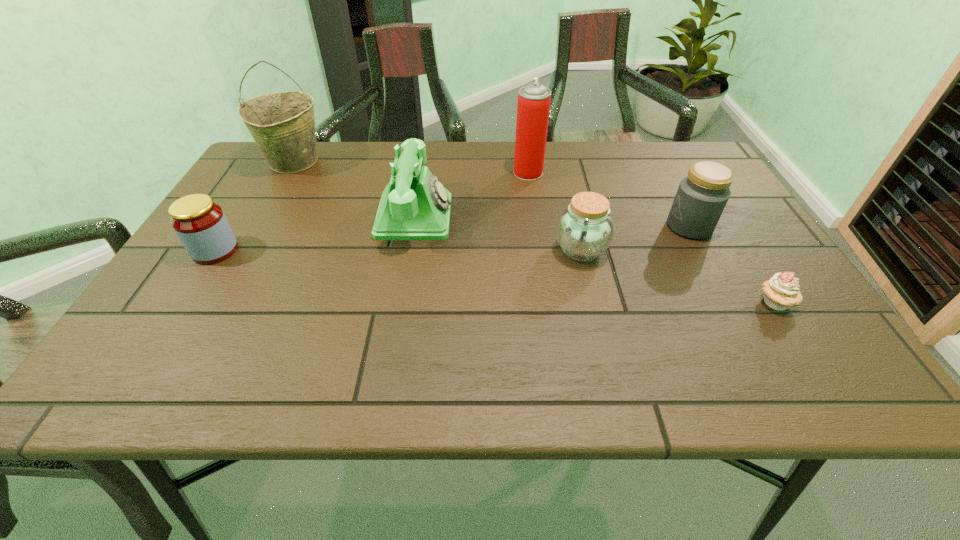
This screenshot has width=960, height=540. Identify the location of wine bucket. (282, 124).

The image size is (960, 540). Find the location of `aerosol can`. aerosol can is located at coordinates (533, 107).

Find the location of a particular element. This screenshot has height=540, width=960. telephone is located at coordinates (415, 205).

At what (x,y) coordinates should I click in order to perform the action: click on the second object from right to left. Please return your answer as a coordinate pair (x, y). This screenshot has height=540, width=960. Looking at the image, I should click on (701, 197).

Where is `the second jar from right to left`? The image size is (960, 540). the second jar from right to left is located at coordinates 585,229.

Locate an element on the screen. The width and height of the screenshot is (960, 540). the leftmost jar is located at coordinates (200, 224).

The image size is (960, 540). What are the coordinates of `the rightmost object` in the screenshot? It's located at (780, 292).

Where is `the shortest object`? This screenshot has width=960, height=540. the shortest object is located at coordinates (780, 292).

At what (x,y) coordinates should I click in order to perform the action: click on vacant space located on the right of the wine bucket. Please return your answer as a coordinate pair (x, y). The height and width of the screenshot is (540, 960). Looking at the image, I should click on (383, 162).

This screenshot has width=960, height=540. Identify the location of vacant area situated on the right of the aerosol can. coord(586,173).